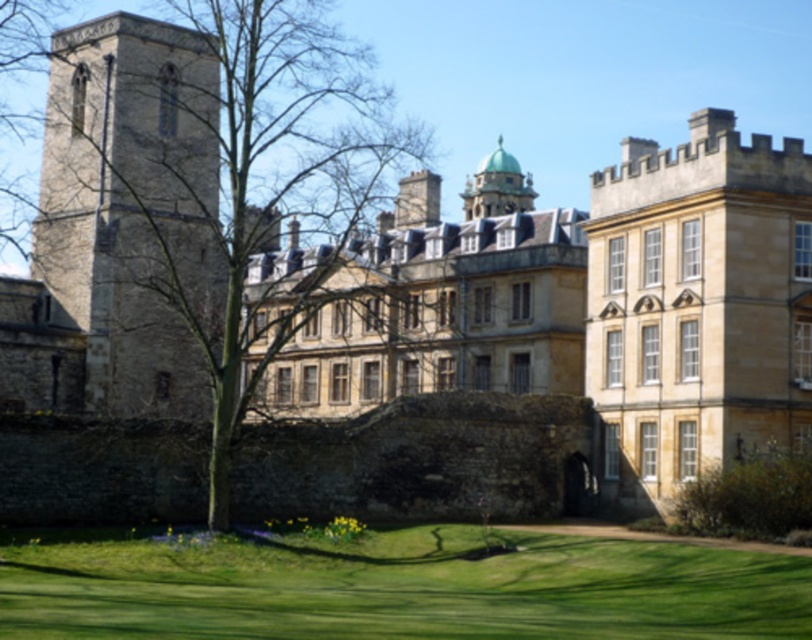
You are standing in front of the grand historic building and want to walk towards the green grass at lower center. Which direction should you move relative to the stone tower at left?

To reach the green grass at lower center, you should move to the right relative to the stone tower at left since the green grass at lower center is positioned to the right of the stone tower at left.